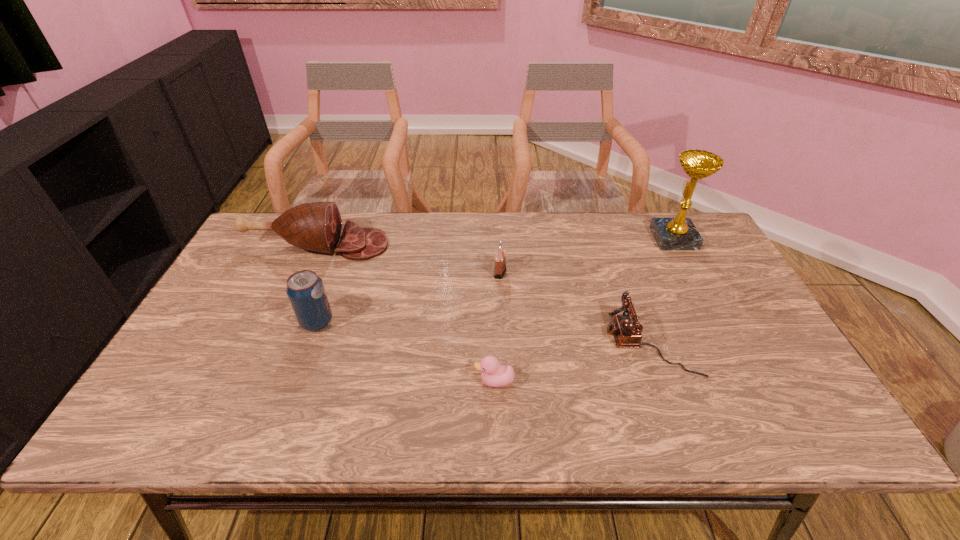
This screenshot has height=540, width=960. I want to click on award, so click(x=679, y=233).

The image size is (960, 540). Identify the location of the rightmost object. (679, 233).

Identify the location of ham. (316, 226).

Identify the location of pop soda. (305, 290).

Where is `padlock`? padlock is located at coordinates (500, 257).

Locate an element on the screen. The height and width of the screenshot is (540, 960). the second object from right to left is located at coordinates (627, 331).

Find the location of a particular element. the shortest object is located at coordinates (493, 374).

At what (x,y) coordinates should I click in order to perform the action: click on vacant space located on the front-facing side of the rightmost object. Please return your answer as a coordinate pair (x, y). Looking at the image, I should click on (534, 239).

This screenshot has height=540, width=960. What are the coordinates of `vacant area located on the front-facing side of the rightmost object` in the screenshot? It's located at (609, 239).

Where is `blank area located 0.360m on the front-facing side of the rightmost object`? The image size is (960, 540). blank area located 0.360m on the front-facing side of the rightmost object is located at coordinates (543, 239).